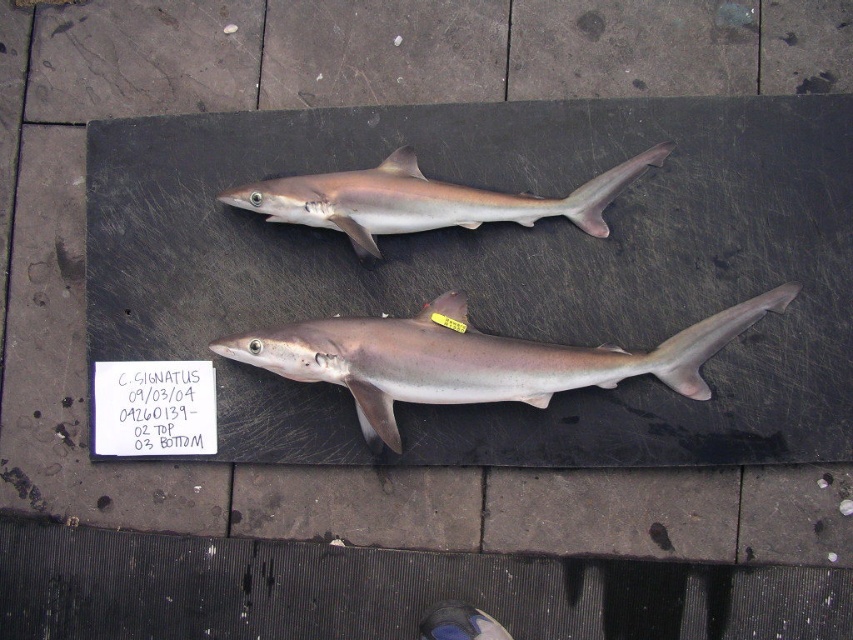
Is smooth gray shark at center closer to camera compared to smooth gray shark at upper center?

Yes, it is in front of smooth gray shark at upper center.

Is smooth gray shark at center to the right of smooth gray shark at upper center from the viewer's perspective?

Indeed, smooth gray shark at center is positioned on the right side of smooth gray shark at upper center.

I want to click on smooth gray shark at center, so click(x=474, y=358).

Does smooth gray shark at upper center appear over white paper at center?

Correct, smooth gray shark at upper center is located above white paper at center.

I want to click on smooth gray shark at upper center, so click(x=422, y=198).

Measure the distance from smooth gray shark at center to white paper at center.

They are 10.52 inches apart.

Does smooth gray shark at center appear under white paper at center?

No, smooth gray shark at center is not below white paper at center.

What do you see at coordinates (474, 358) in the screenshot?
I see `smooth gray shark at center` at bounding box center [474, 358].

At what (x,y) coordinates should I click in order to perform the action: click on smooth gray shark at center. Please return your answer as a coordinate pair (x, y). Looking at the image, I should click on (474, 358).